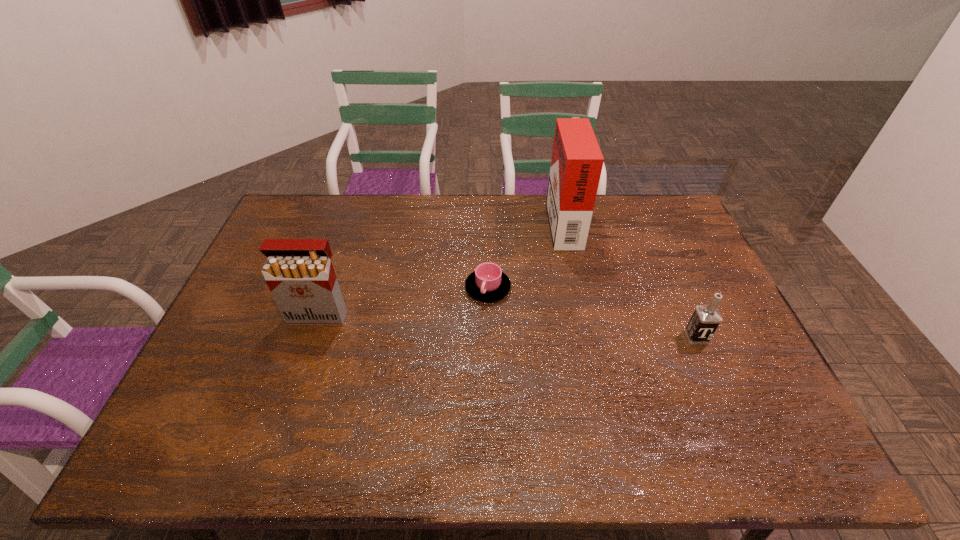
Where is `the farther cigarette case`? the farther cigarette case is located at coordinates (576, 164).

This screenshot has width=960, height=540. Identify the location of the farthest object. (576, 164).

Where is `the leftmost object`? the leftmost object is located at coordinates (299, 273).

Find the location of a particular element. The height and width of the screenshot is (540, 960). the left cigarette case is located at coordinates (299, 273).

Locate an element on the screen. The image size is (960, 540). the rightmost object is located at coordinates (705, 320).

Image resolution: width=960 pixels, height=540 pixels. What are the coordinates of `vodka` in the screenshot? It's located at (705, 320).

Identify the location of cup. (487, 283).

You are a GUI agent. You are given a task and a screenshot of the screen. Output one action in this format:
    pyautogui.click(x=<x>, y=<y>)
    Task: Click on the shortest object
    
    Given the screenshot: What is the action you would take?
    pyautogui.click(x=487, y=283)

Identify the location of vacant space located on the front-facing side of the taller cigarette case. (532, 221).

Find the location of a particular element. free location located 0.390m on the front-facing side of the taller cigarette case is located at coordinates (440, 221).